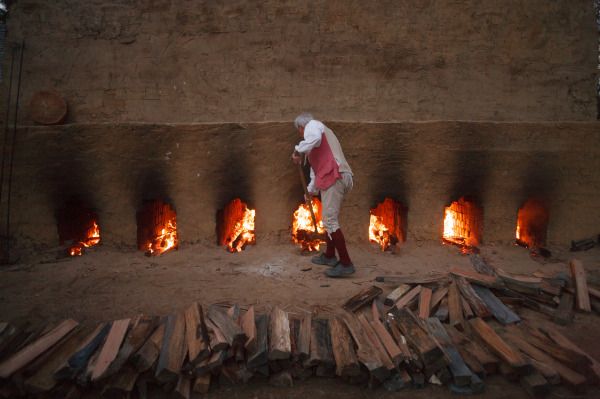
Where is `ovens`? ovens is located at coordinates (83, 229), (163, 222), (242, 228), (301, 218), (386, 216), (461, 222), (526, 233).